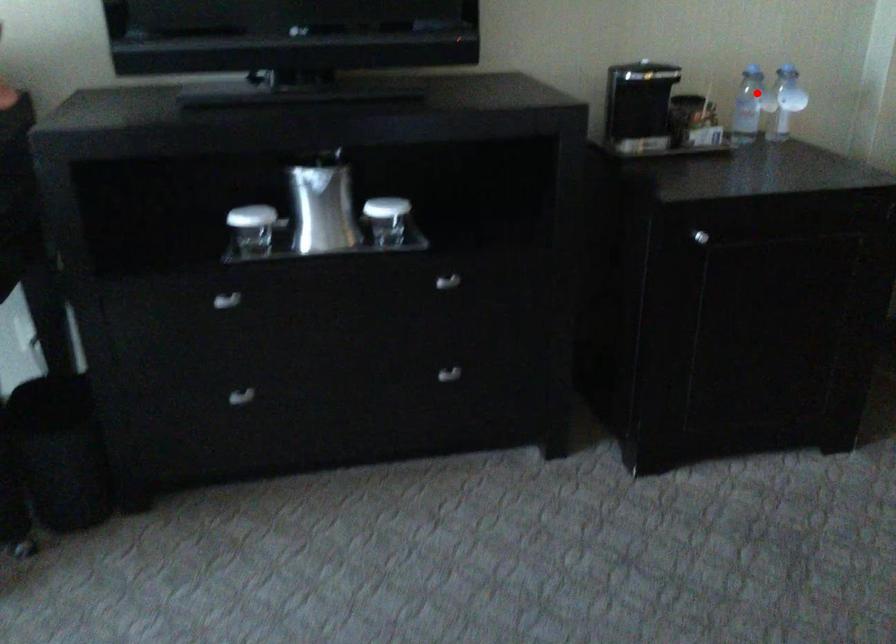
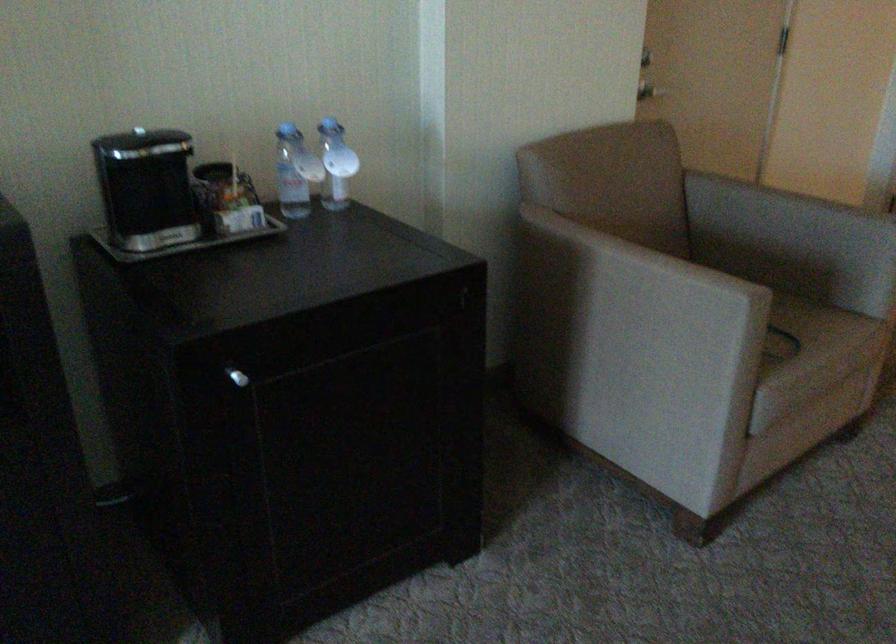
In the second image, find the point that corresponds to the highlighted location in the first image.

(295, 172)